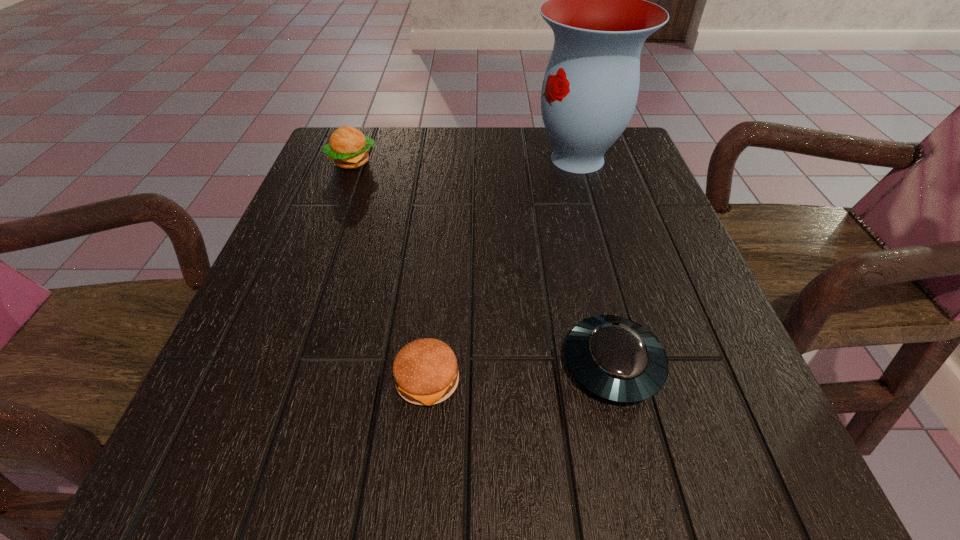
Find the location of a particular element. free region at the near left corner of the desktop is located at coordinates (255, 461).

You are a GUI agent. You are given a task and a screenshot of the screen. Output one action in this format:
    pyautogui.click(x=<x>, y=<y>)
    Task: Click on the vacant space at the far right corner of the desktop
    
    Given the screenshot: What is the action you would take?
    pyautogui.click(x=625, y=133)

Locate an element on the screen. blank space at the near right corner of the desktop is located at coordinates (787, 491).

You are a GUI agent. You are given a task and a screenshot of the screen. Output one action in this format:
    pyautogui.click(x=<x>, y=<y>)
    Task: Click on the empty space between the farther hamburger and the vase
    This screenshot has height=540, width=960.
    Given the screenshot: What is the action you would take?
    pyautogui.click(x=465, y=160)

Where is `free spot between the tallest object and the nearer hamburger`? This screenshot has height=540, width=960. free spot between the tallest object and the nearer hamburger is located at coordinates (502, 269).

At what (x,y) coordinates should I click in order to perform the action: click on free space between the saucer and the nearer hamburger. Please return your answer as a coordinate pair (x, y). Looking at the image, I should click on (520, 372).

Image resolution: width=960 pixels, height=540 pixels. In order to click on free space between the vase and the saucer in this screenshot , I will do `click(595, 261)`.

Identify the location of vacant region between the tallest object and the third shortest object. (465, 160).

Locate an element on the screen. Image resolution: width=960 pixels, height=540 pixels. free space that is in between the taller hamburger and the saucer is located at coordinates (482, 263).

This screenshot has height=540, width=960. In order to click on vacant space that is in between the taller hamburger and the nearer hamburger in this screenshot , I will do `click(390, 271)`.